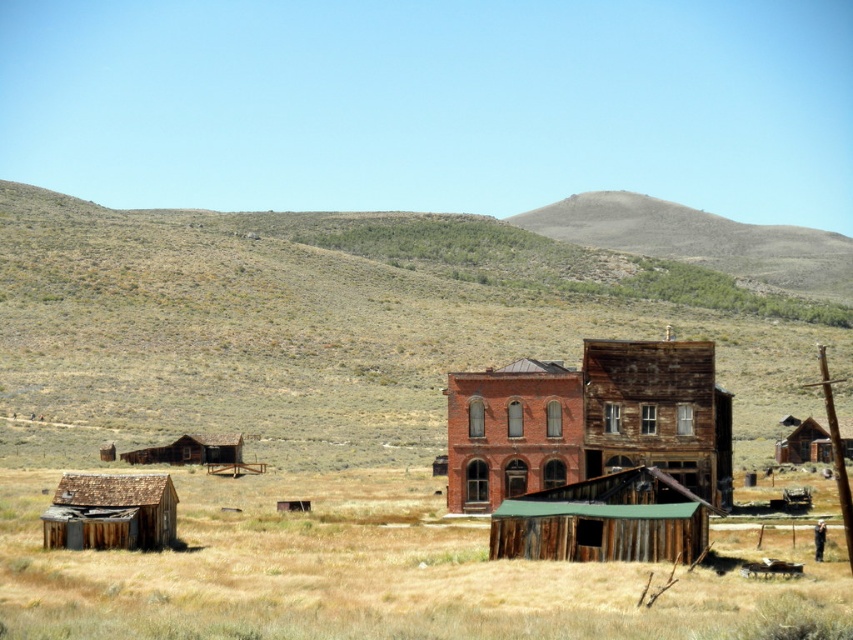
You are a photographer standing at the edge of the abandoned town. You want to take a photo that includes both the weathered wood hut at lower left and the wooden shack at right. Based on their positions, which structure will appear larger in the photo?

The weathered wood hut at lower left is closer to the viewer than the wooden shack at right, so it will appear larger in the photo.